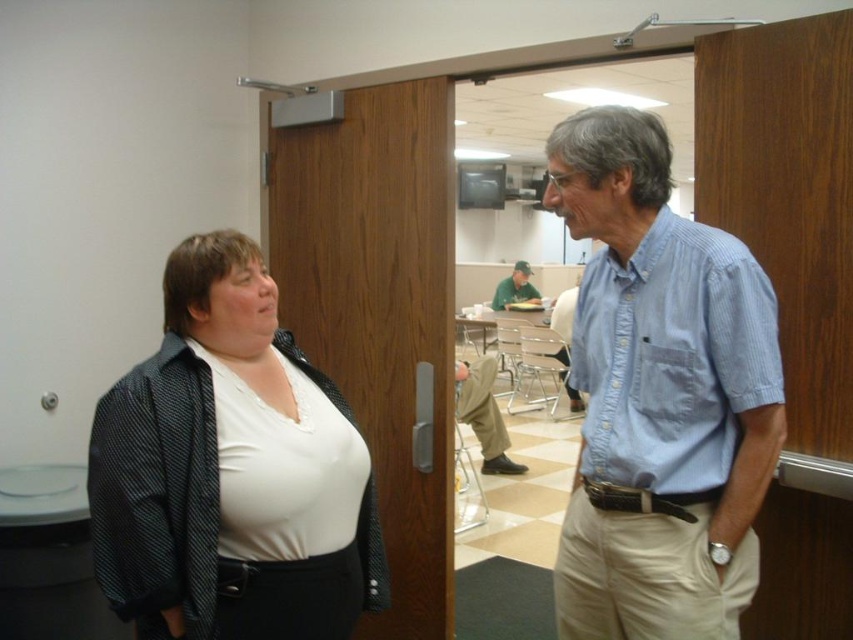
You are a photographer trying to capture a candid shot of the two people in the scene. You want to ensure that both the white matte shirt at center and the khaki pants at center are in focus. Given that your camera has a depth of field that can cover 3 meters, will you be able to capture both objects in focus?

The white matte shirt at center and the khaki pants at center are 2.87 meters apart. Since the camera can cover 3 meters, the distance between them is within the depth of field range, so both objects can be in focus.